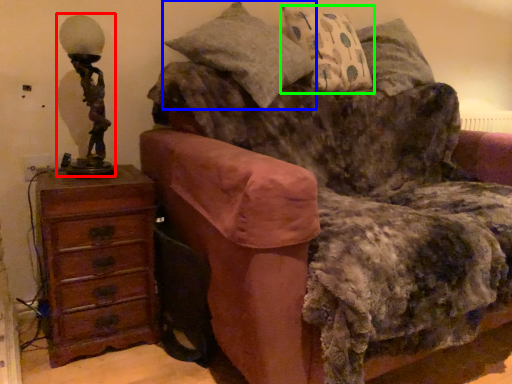
Question: Which is farther away from table lamp (highlighted by a red box)? pillow (highlighted by a blue box) or pillow (highlighted by a green box)?

Choices:
 (A) pillow
 (B) pillow

Answer: (B)